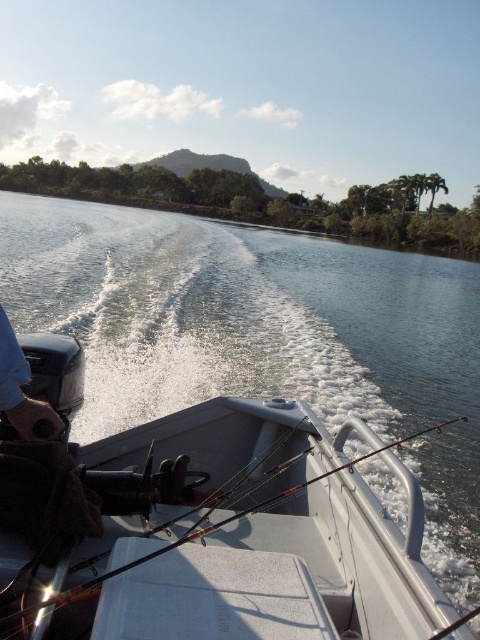
You are a passenger in the white plastic boat at center. You see a blue fabric glove at lower left. Which object is bigger?

The white plastic boat at center is bigger than the blue fabric glove at lower left.

You are standing on the dock and see the white plastic boat at center and the blue fabric glove at lower left in the water. Which object is closer to the dock?

The blue fabric glove at lower left is closer to the dock because it is positioned to the left of the white plastic boat at center, which is further away.